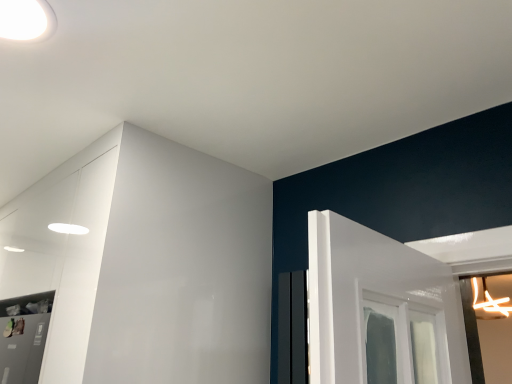
Question: Visually, is white glossy light fixture at upper left positioned to the left or to the right of white glossy dresser at upper left?

Choices:
 (A) right
 (B) left

Answer: (A)

Question: In terms of size, does white glossy light fixture at upper left appear bigger or smaller than white glossy dresser at upper left?

Choices:
 (A) big
 (B) small

Answer: (B)

Question: Considering the positions of point (39, 18) and point (38, 243), is point (39, 18) closer or farther from the camera than point (38, 243)?

Choices:
 (A) farther
 (B) closer

Answer: (B)

Question: Is white glossy dresser at upper left in front of or behind white glossy light fixture at upper left in the image?

Choices:
 (A) behind
 (B) front

Answer: (A)

Question: Is white glossy dresser at upper left bigger or smaller than white glossy light fixture at upper left?

Choices:
 (A) big
 (B) small

Answer: (A)

Question: Visually, is white glossy dresser at upper left positioned to the left or to the right of white glossy light fixture at upper left?

Choices:
 (A) left
 (B) right

Answer: (A)

Question: Does point (136, 140) appear closer or farther from the camera than point (27, 39)?

Choices:
 (A) closer
 (B) farther

Answer: (B)